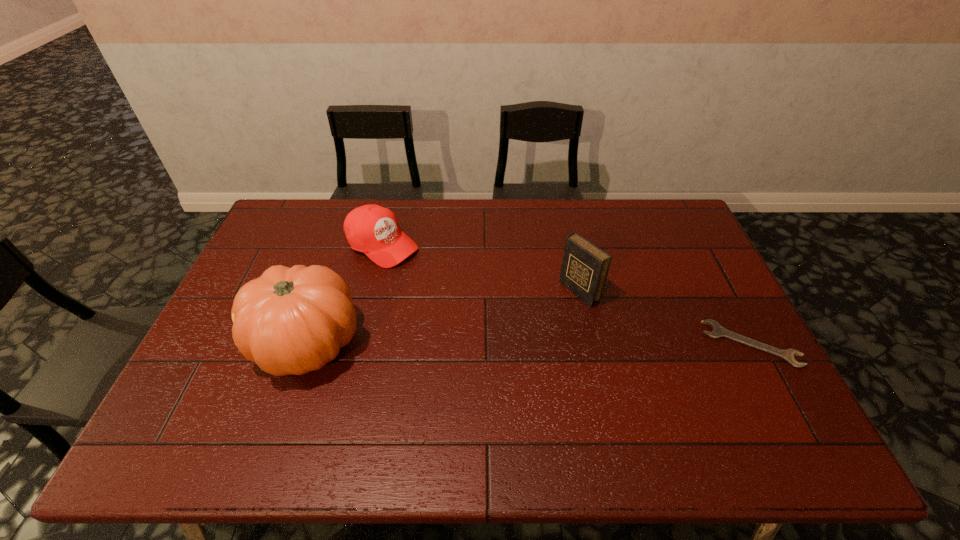
The width and height of the screenshot is (960, 540). In order to click on object present at the near left corner in this screenshot , I will do `click(294, 320)`.

In the image, there is a desktop. Where is `vacant space at the far edge`? This screenshot has height=540, width=960. vacant space at the far edge is located at coordinates (421, 220).

Find the location of a particular element. free region at the near edge of the desktop is located at coordinates (397, 410).

You are a GUI agent. You are given a task and a screenshot of the screen. Output one action in this format:
    pyautogui.click(x=<x>, y=<y>)
    Task: Click on the vacant space at the right edge of the desktop
    This screenshot has height=540, width=960.
    Given the screenshot: What is the action you would take?
    pyautogui.click(x=660, y=267)

Image resolution: width=960 pixels, height=540 pixels. I want to click on free location at the far right corner of the desktop, so click(643, 212).

The width and height of the screenshot is (960, 540). I want to click on empty location between the third tallest object and the diary, so click(x=480, y=268).

I want to click on vacant space that is in between the rightmost object and the diary, so click(x=664, y=318).

At what (x,y) coordinates should I click in order to perform the action: click on empty space that is in between the second object from right to left and the second shortest object. Please return your answer as a coordinate pair (x, y). The width and height of the screenshot is (960, 540). Looking at the image, I should click on (480, 268).

I want to click on vacant space that is in between the farthest object and the rightmost object, so click(x=566, y=294).

The image size is (960, 540). Identify the location of free point between the diary and the wrench. (664, 318).